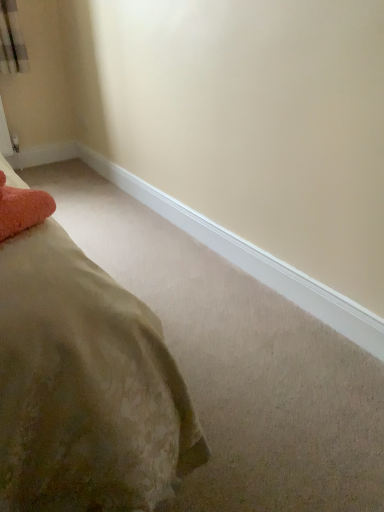
At what (x,y) coordinates should I click in order to perform the action: click on free location above beige fabric bed at lower left (from a real-world perspective). Please return your answer as a coordinate pair (x, y). Looking at the image, I should click on click(139, 261).